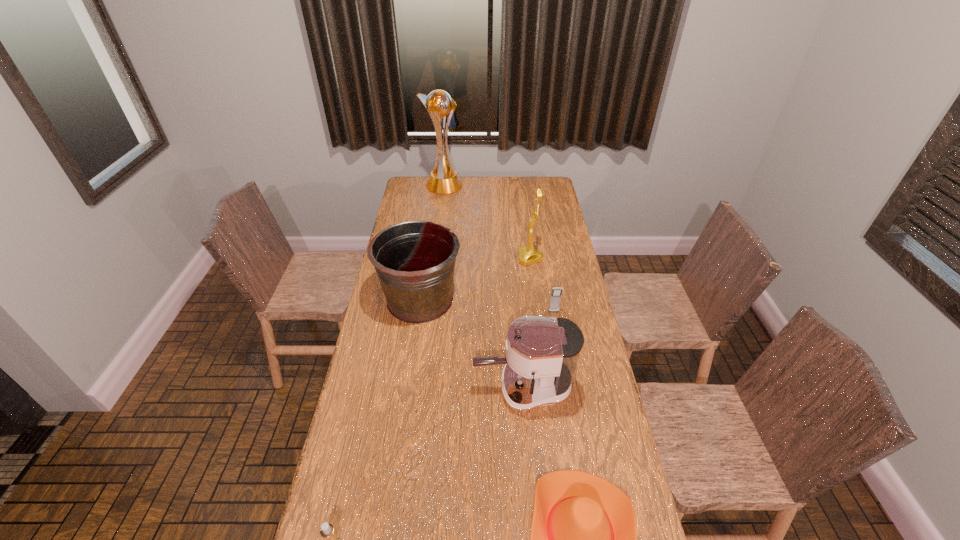
At what (x,y) coordinates should I click in order to perform the action: click on trophy. Please return your answer as a coordinate pair (x, y). The image size is (960, 540). Looking at the image, I should click on (443, 179).

The image size is (960, 540). Find the location of `the farthest object`. the farthest object is located at coordinates (443, 179).

I want to click on award, so click(x=528, y=255).

You are a GUI agent. You are given a task and a screenshot of the screen. Output one action in this format:
    pyautogui.click(x=<x>, y=<y>)
    Task: Click on the fifth farthest object
    The height and width of the screenshot is (540, 960).
    Given the screenshot: What is the action you would take?
    pyautogui.click(x=542, y=353)

Locate an element on the screen. This screenshot has height=540, width=960. bucket is located at coordinates (415, 261).

I want to click on cellular telephone, so click(x=555, y=298).

Image resolution: width=960 pixels, height=540 pixels. I want to click on vacant space located on the front-facing side of the trophy, so click(x=494, y=186).

I want to click on free point located 0.160m on the front-facing side of the sixth nearest object, so click(x=483, y=258).

The image size is (960, 540). In order to click on vacant space located on the front-facing side of the sixth nearest object in this screenshot , I will do point(450,258).

Locate an element on the screen. The image size is (960, 540). vacant region located 0.110m on the front-facing side of the sixth nearest object is located at coordinates (494, 258).